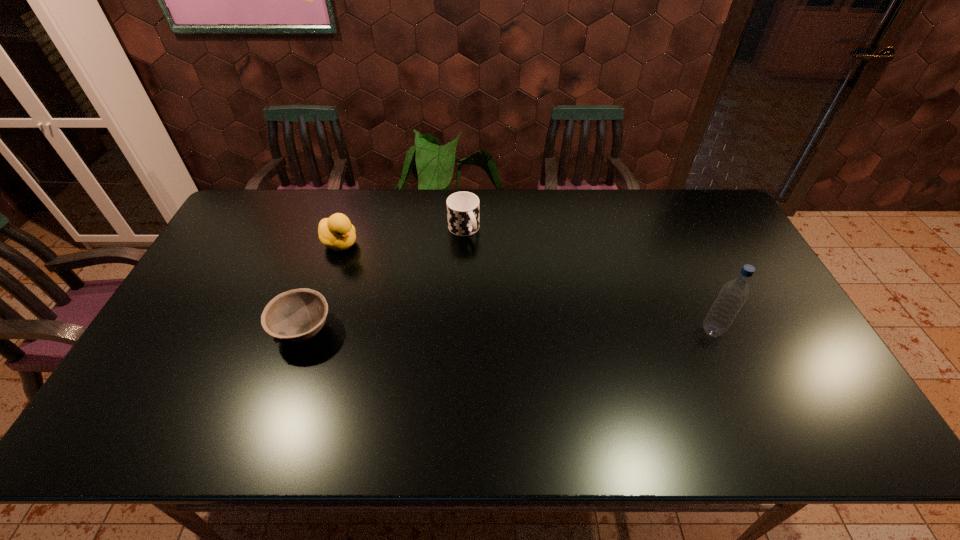
I want to click on free spot on the desktop that is between the bowl and the tallest object and is positioned on the side of the second object from right to left with the handle, so click(536, 331).

Image resolution: width=960 pixels, height=540 pixels. What are the coordinates of `vacant spot on the desktop that is between the bowl and the tallest object and is positioned on the front-facing side of the second tallest object` in the screenshot? It's located at (486, 331).